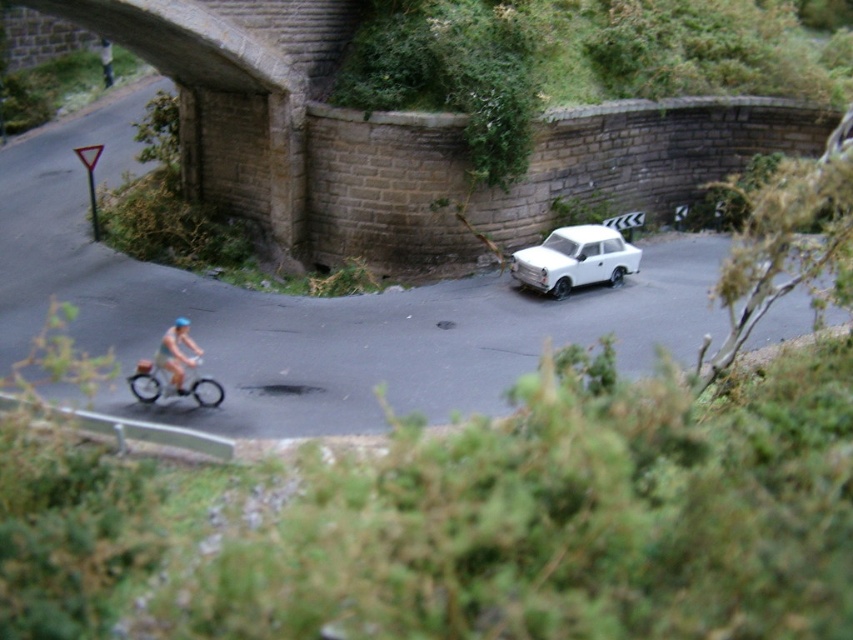
Question: Which point is closer to the camera?

Choices:
 (A) metallic silver bicycle at left
 (B) white matte car at center

Answer: (A)

Question: Which point is farther from the camera taking this photo?

Choices:
 (A) 137,364
 (B) 614,232
 (C) 175,349

Answer: (B)

Question: Can you confirm if metallic silver bicycle at left is smaller than light blue fabric cyclist at lower left?

Choices:
 (A) yes
 (B) no

Answer: (A)

Question: Which of the following is the farthest from the observer?

Choices:
 (A) (166, 333)
 (B) (212, 397)
 (C) (553, 289)

Answer: (C)

Question: Is metallic silver bicycle at left to the right of light blue fabric cyclist at lower left from the viewer's perspective?

Choices:
 (A) yes
 (B) no

Answer: (B)

Question: Can you confirm if metallic silver bicycle at left is positioned below light blue fabric cyclist at lower left?

Choices:
 (A) yes
 (B) no

Answer: (A)